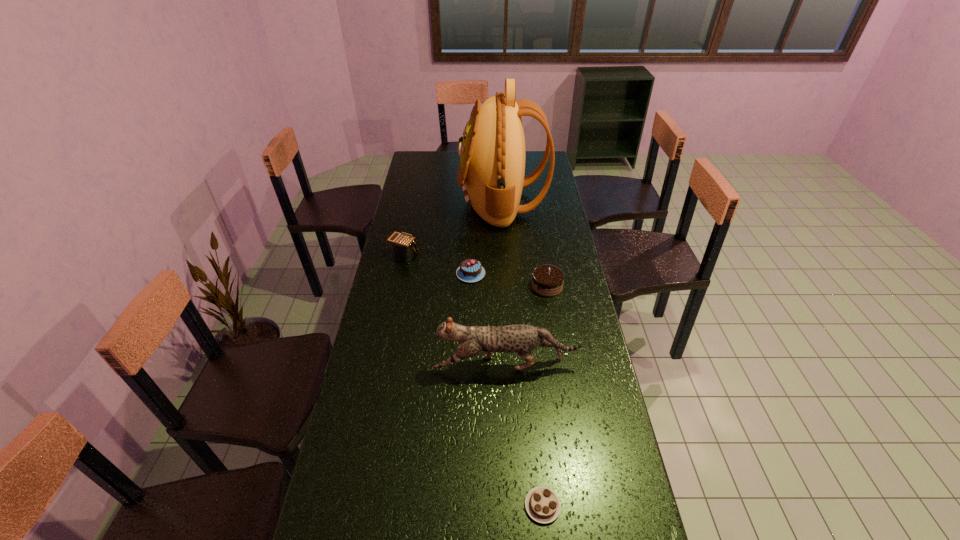
Where is `the shortest chocolate cake`? The image size is (960, 540). the shortest chocolate cake is located at coordinates (542, 504).

Where is `free space located 0.290m on the front-facing side of the backpack`? This screenshot has height=540, width=960. free space located 0.290m on the front-facing side of the backpack is located at coordinates (398, 202).

Locate an element on the screen. This screenshot has width=960, height=540. free space located 0.230m on the front-facing side of the backpack is located at coordinates (411, 202).

Locate an element on the screen. The width and height of the screenshot is (960, 540). free location located on the front-facing side of the backpack is located at coordinates tap(440, 202).

This screenshot has width=960, height=540. Identify the location of free region located 0.100m on the face of the fifth farthest object. (402, 364).

In order to click on vacant space located on the face of the fifth farthest object in this screenshot , I will do pos(390,364).

This screenshot has height=540, width=960. What are the coordinates of `free space located 0.290m on the left of the tallest chocolate cake` in the screenshot? It's located at (456, 286).

You are a GUI agent. You are given a task and a screenshot of the screen. Output one action in this format:
    pyautogui.click(x=<x>, y=<y>)
    Task: Click on the free region located 0.210m on the back of the leftmost object
    The height and width of the screenshot is (540, 960).
    Given the screenshot: What is the action you would take?
    pyautogui.click(x=412, y=218)

Identify the location of vacant space located on the right of the fifth tallest object. (572, 274).

This screenshot has width=960, height=540. Find the location of `vacant region located on the left of the nearest object`. vacant region located on the left of the nearest object is located at coordinates (368, 506).